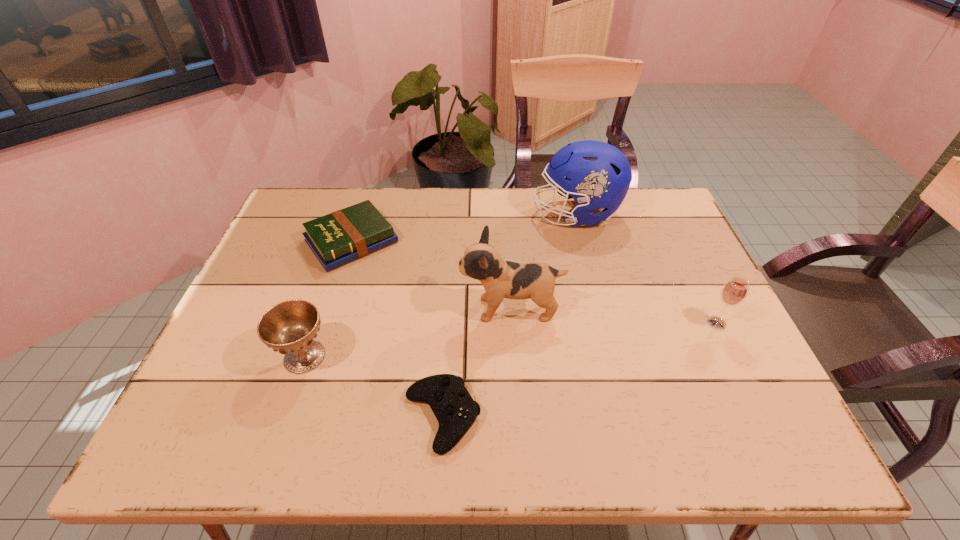
This screenshot has height=540, width=960. I want to click on free region located 0.110m at the face of the puppy, so click(x=417, y=309).

Image resolution: width=960 pixels, height=540 pixels. Find the location of `vacant space located at the face of the puppy`. vacant space located at the face of the puppy is located at coordinates (390, 309).

Locate an element on the screen. The width and height of the screenshot is (960, 540). vacant space located at the face of the puppy is located at coordinates (342, 309).

At what (x,y) coordinates should I click in order to perform the action: click on free region located on the back of the wineglass. Please return your answer as a coordinate pair (x, y). This screenshot has width=960, height=540. Looking at the image, I should click on (692, 273).

Identify the location of vacant region located on the right of the second nearest object. (449, 356).

In order to click on free space located 0.050m on the back of the book in this screenshot , I will do `click(363, 204)`.

Find the location of a particular element. free location located on the right of the shortest object is located at coordinates (626, 418).

This screenshot has width=960, height=540. I want to click on football helmet that is at the far edge, so [597, 175].

This screenshot has width=960, height=540. Identify the location of book that is at the far edge. (345, 235).

Locate an element on the screen. object present at the near edge is located at coordinates (454, 408).